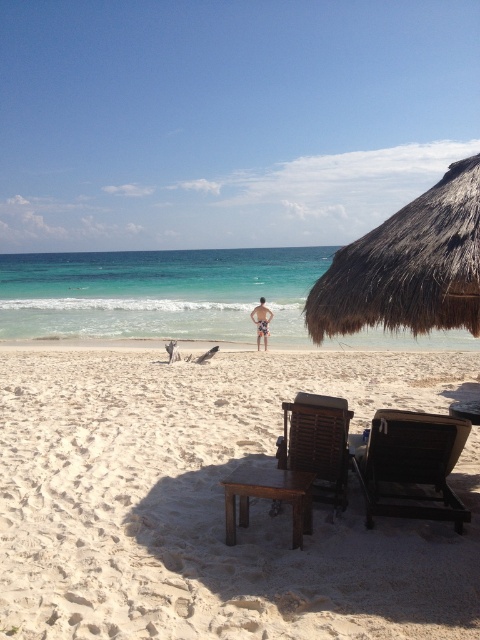
You are planning to set up a beach umbrella for shade. You have a brown thatch umbrella at upper right and a brown wooden stool at center. Which object has a wider base to provide more stability against the wind?

The brown thatch umbrella at upper right has a larger width than the brown wooden stool at center, so it has a wider base and would provide more stability against the wind.

Looking at this image, you are a beachgoer who wants to place your printed fabric shorts at center on top of the brown wooden stool at center. Is the stool tall enough to keep the shorts out of reach from someone sitting on the sand? Please explain your reasoning.

The brown wooden stool at center is not as tall as printed fabric shorts at center, meaning the stool is shorter than the shorts. Therefore, placing the shorts on the stool might not keep them out of reach since the stool itself is not tall enough to elevate the shorts above the sitting height of someone on the sand.